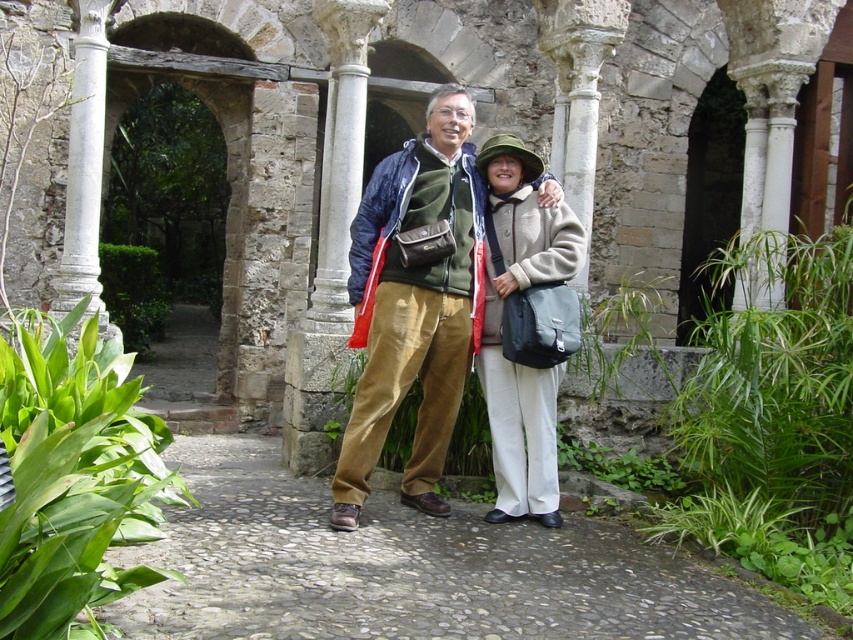
Question: Does gray cobblestone path at center appear over white stone column at center-left?

Choices:
 (A) yes
 (B) no

Answer: (B)

Question: Based on their relative distances, which object is farther from the gray cobblestone path at center?

Choices:
 (A) matte green jacket at center
 (B) light beige wool coat at center

Answer: (B)

Question: Which of the following is the closest to the observer?

Choices:
 (A) gray cobblestone path at center
 (B) light beige wool coat at center
 (C) white stone column at center-left
 (D) matte green jacket at center

Answer: (A)

Question: Does gray cobblestone path at center appear under white stone column at center-left?

Choices:
 (A) yes
 (B) no

Answer: (A)

Question: Which of the following is the farthest from the observer?

Choices:
 (A) (743, 604)
 (B) (100, 109)

Answer: (B)

Question: Can you confirm if gray cobblestone path at center is bigger than matte green jacket at center?

Choices:
 (A) yes
 (B) no

Answer: (B)